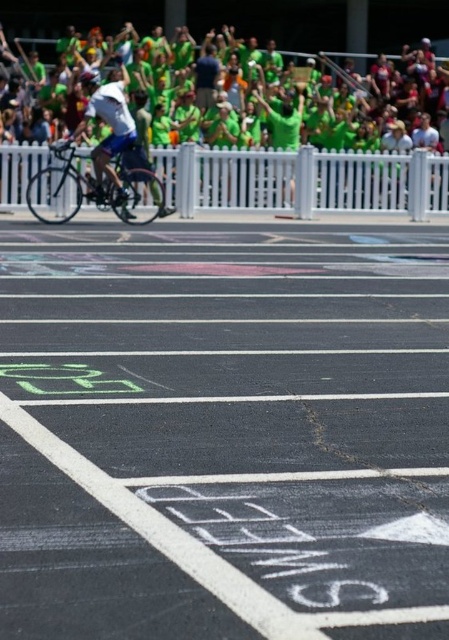
You are a drone operator tasked with capturing aerial footage of the black asphalt race track at center. Your drone is currently hovering above the point labeled as point (224, 429). Is the drone currently above the black asphalt race track at center?

Yes, the drone is currently above the black asphalt race track at center because the point (224, 429) is where the black asphalt race track at center is located.

You are a cyclist approaching the finish line and notice two green items at upper center. Which one is closer to you, the green fabric crowd at upper center or the green jersey at upper center?

The green fabric crowd at upper center is in front of the green jersey at upper center, so the green fabric crowd at upper center is closer to you.

You are a drone operator trying to capture the cyclist during the race. The black asphalt race track at center and the matte black helmet at upper center are both in your camera frame. Which object appears larger in your camera view?

The black asphalt race track at center appears larger in the camera view because it is taller than the matte black helmet at upper center.